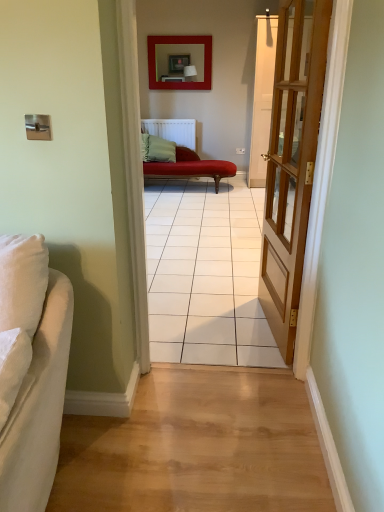
Find the location of a particular element. The image size is (384, 512). free space above light wood floor at center (from a real-world perspective) is located at coordinates (199, 429).